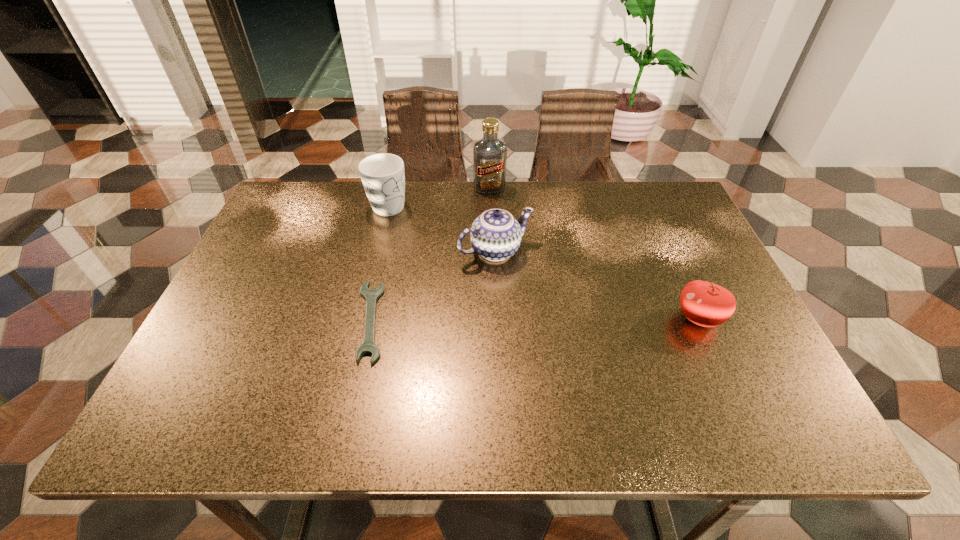
This screenshot has height=540, width=960. I want to click on vacant spot on the desktop that is between the shortest object and the second shortest object and is positioned at the spout of the third nearest object, so click(551, 319).

The width and height of the screenshot is (960, 540). Identify the location of vacant spot on the desktop that is between the shortest object and the apple and is positioned on the side of the mug with the handle. (499, 320).

At what (x,y) coordinates should I click in order to perform the action: click on vacant spot on the desktop that is between the shortest object and the rightmost object and is positioned on the front-facing side of the tallest object. Please return your answer as a coordinate pair (x, y). Image resolution: width=960 pixels, height=540 pixels. Looking at the image, I should click on (509, 320).